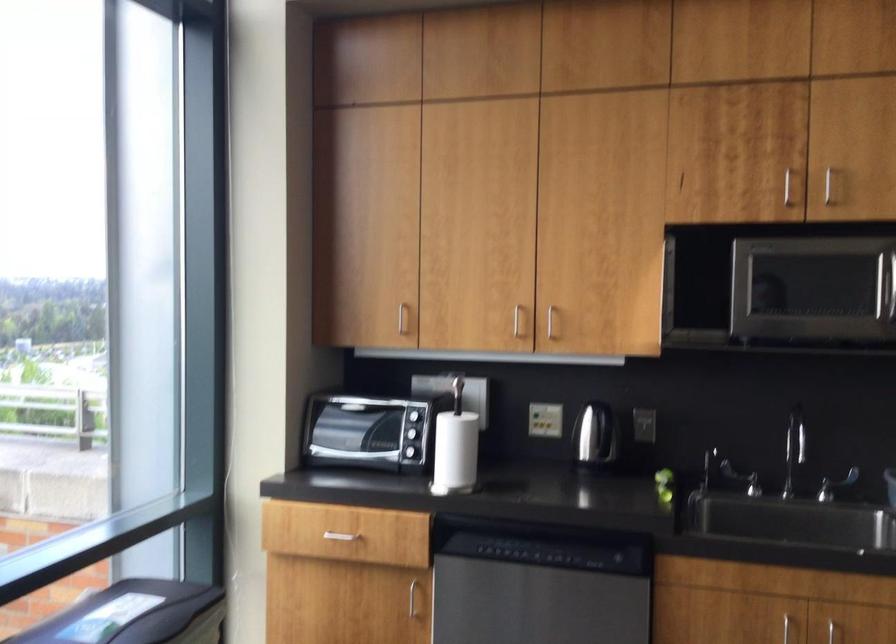
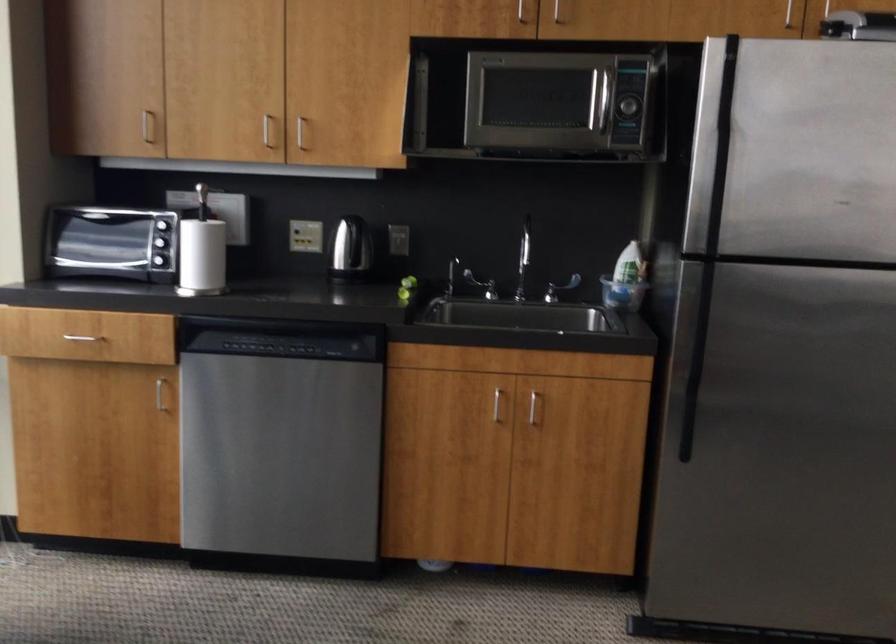
In a continuous first-person perspective shot, in which direction is the camera moving?

The movement direction of the cameraman is right, backward.